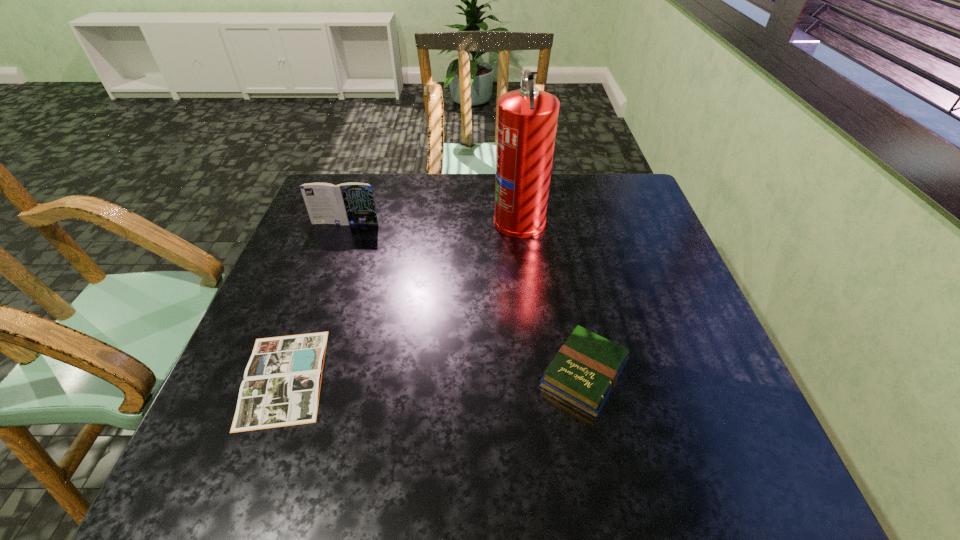
Locate which object ranks second in proximity to the rightmost book. Please provide its 2D coordinates. Your answer should be formatted as a tuple, i.e. [(x, y)], where the tuple contains the x and y coordinates of a point satisfying the conditions above.

[(281, 387)]

Point out which book is positioned as the nearest to the second tallest object. Please provide its 2D coordinates. Your answer should be formatted as a tuple, i.e. [(x, y)], where the tuple contains the x and y coordinates of a point satisfying the conditions above.

[(281, 387)]

Where is `book that is the second closest to the third shortest object`? Image resolution: width=960 pixels, height=540 pixels. book that is the second closest to the third shortest object is located at coordinates click(x=584, y=372).

You are a GUI agent. You are given a task and a screenshot of the screen. Output one action in this format:
    pyautogui.click(x=<x>, y=<y>)
    Task: Click on the free space that satisfies the following two spatial constraints: 1. on the back side of the rightmost book; 2. on the instruction side of the tallest object
    The height and width of the screenshot is (540, 960).
    Given the screenshot: What is the action you would take?
    pyautogui.click(x=554, y=220)

Image resolution: width=960 pixels, height=540 pixels. In order to click on vacant space that satisfies the following two spatial constraints: 1. on the instruction side of the fire extinguisher; 2. on the front cover of the third shortest object in this screenshot , I will do `click(519, 223)`.

This screenshot has width=960, height=540. I want to click on free space that satisfies the following two spatial constraints: 1. on the instruction side of the tallest object; 2. on the front cover of the tallest book, so click(519, 223).

The height and width of the screenshot is (540, 960). What are the coordinates of `free space that satisfies the following two spatial constraints: 1. on the instruction side of the tallest object; 2. on the front cover of the third shortest object` in the screenshot? It's located at (519, 223).

Identify the location of free space that satisfies the following two spatial constraints: 1. on the instruction side of the fire extinguisher; 2. on the back side of the second shortest book. This screenshot has height=540, width=960. (536, 374).

Image resolution: width=960 pixels, height=540 pixels. In order to click on blank space that satisfies the following two spatial constraints: 1. on the instruction side of the rightmost book; 2. on the right side of the tallest object in this screenshot , I will do `click(536, 374)`.

In order to click on free space that satisfies the following two spatial constraints: 1. on the front cover of the third tallest object; 2. on the right side of the farthest book in this screenshot , I will do `click(292, 374)`.